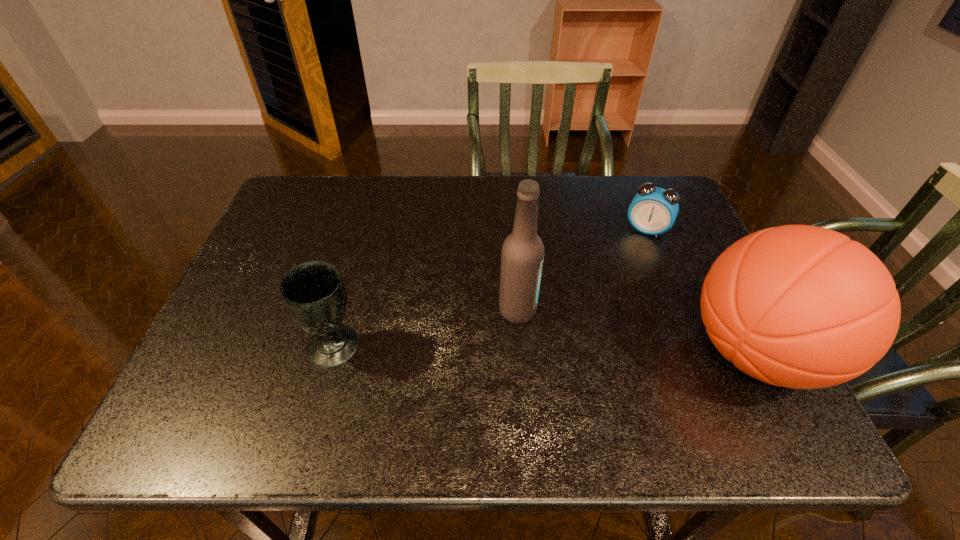
I want to click on free location located on the face of the shortest object, so click(x=604, y=315).

The image size is (960, 540). I want to click on vacant point located on the label of the third object from right to left, so click(575, 337).

What are the coordinates of `free location located on the label of the third object from right to left` in the screenshot? It's located at (571, 335).

The width and height of the screenshot is (960, 540). In order to click on vacant area situated 0.100m on the label of the third object from right to left in this screenshot , I will do `click(575, 337)`.

Where is `object situated at the far edge`? object situated at the far edge is located at coordinates coord(653,211).

Where is `chalice located in the near edge section of the desktop`? The width and height of the screenshot is (960, 540). chalice located in the near edge section of the desktop is located at coordinates (313, 292).

I want to click on basketball that is at the near edge, so click(798, 306).

At what (x,y) coordinates should I click in order to perform the action: click on basketball located at the right edge. Please return your answer as a coordinate pair (x, y). Looking at the image, I should click on (798, 306).

I want to click on alarm clock located in the right edge section of the desktop, so click(653, 211).

This screenshot has width=960, height=540. I want to click on object that is at the far right corner, so click(x=653, y=211).